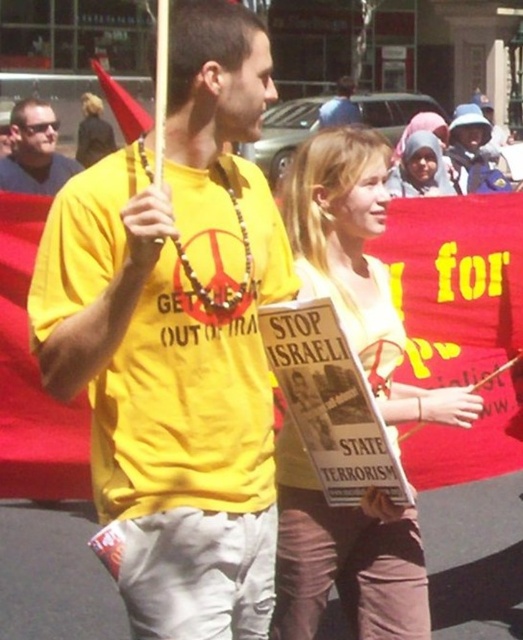
You are a photographer trying to capture a clear photo of both the yellow matte shirt at center and the smooth cardboard sign at center in the protest scene. Based on their sizes, which object should you focus on first to ensure it appears sharp in the photo?

The yellow matte shirt at center is smaller than the smooth cardboard sign at center, so you should focus on the yellow matte shirt at center first to ensure its details are sharp in the photo.

You are a photographer trying to capture a closeup shot of both the yellow matte shirt at center and the smooth cardboard sign at center. Based on their current positions, can you fit both into your camera frame without moving either object? The camera has a maximum field of view that can accommodate objects within 18 inches of each other.

The distance between the yellow matte shirt at center and the smooth cardboard sign at center is 17.06 inches, which is within the camera frame that can accommodate objects within 18 inches of each other. Therefore, you can fit both into the frame without moving them.

You are a photographer standing in the protest scene. You want to take a closeup photo of the smooth cardboard sign at center without moving closer. Can you do it with a standard camera lens that has a maximum zoom of 10x? Explain why or why not.

The smooth cardboard sign at center and viewer are 7.03 feet apart from each other. A standard camera lens with a maximum zoom of 10x can capture a closeup of the smooth cardboard sign at center from that distance.